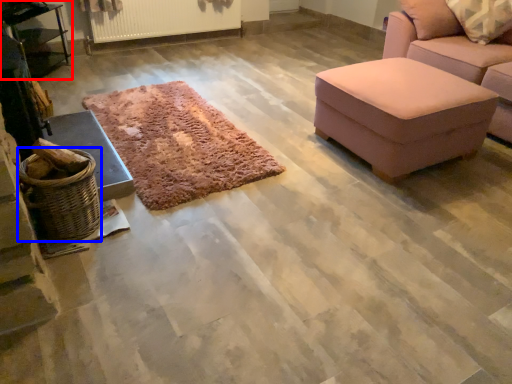
Question: Which object is closer to the camera taking this photo, table (highlighted by a red box) or basket (highlighted by a blue box)?

Choices:
 (A) table
 (B) basket

Answer: (B)